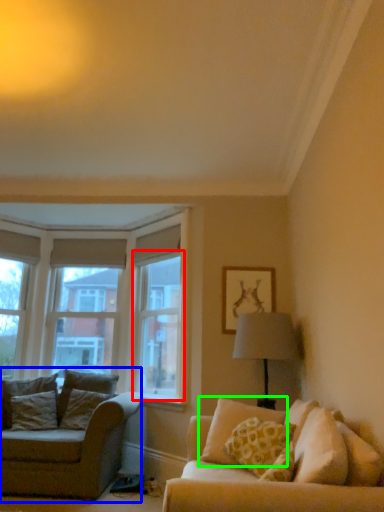
Question: Which object is the farthest from window screen (highlighted by a red box)? Choose among these: studio couch (highlighted by a blue box) or pillow (highlighted by a green box).

Choices:
 (A) studio couch
 (B) pillow

Answer: (B)